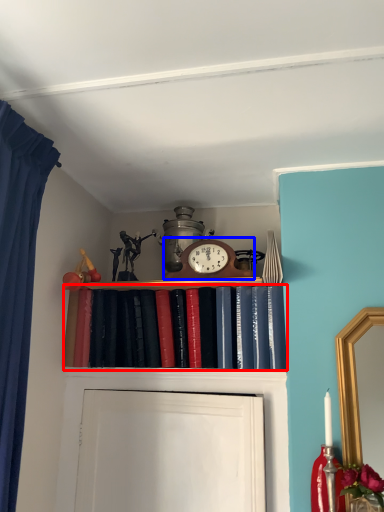
Question: Which point is closer to the camera, book (highlighted by a red box) or alarm clock (highlighted by a blue box)?

Choices:
 (A) book
 (B) alarm clock

Answer: (A)